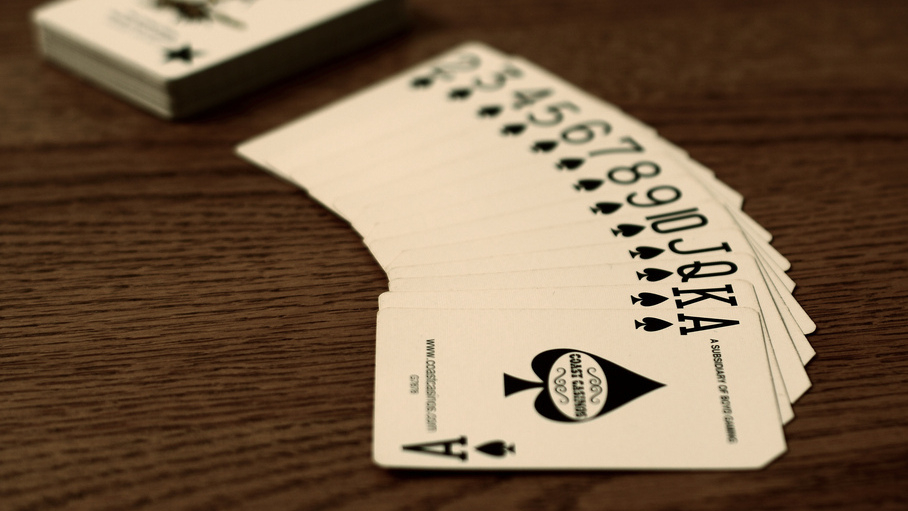
This screenshot has height=511, width=908. I want to click on empty top right corner space, so click(807, 11), click(815, 140), click(889, 138), click(891, 11), click(855, 72).